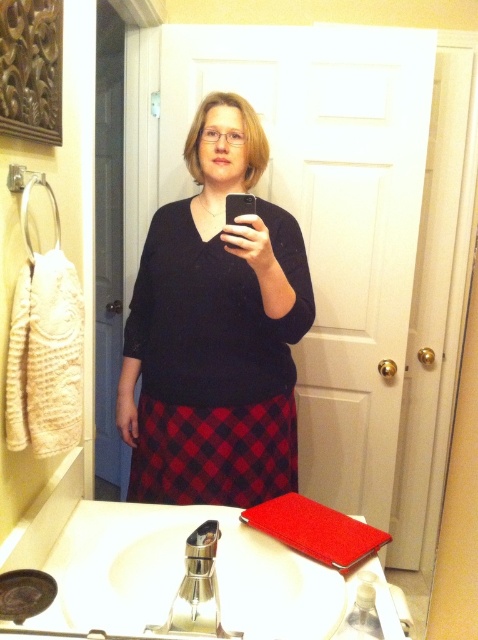
Question: Which of these objects is positioned farthest from the polished stainless steel faucet at sink?

Choices:
 (A) red plaid skirt at center
 (B) black matte smartphone at center

Answer: (B)

Question: Which point is closer to the camera taking this photo?

Choices:
 (A) (243, 198)
 (B) (199, 579)

Answer: (B)

Question: Is polished stainless steel faucet at sink smaller than black matte smartphone at center?

Choices:
 (A) no
 (B) yes

Answer: (A)

Question: Where is red plaid skirt at center located in relation to polished stainless steel faucet at sink in the image?

Choices:
 (A) above
 (B) below

Answer: (A)

Question: Can you confirm if red plaid skirt at center is thinner than black matte smartphone at center?

Choices:
 (A) no
 (B) yes

Answer: (A)

Question: Which object is positioned closest to the red plaid skirt at center?

Choices:
 (A) black matte smartphone at center
 (B) polished stainless steel faucet at sink

Answer: (A)